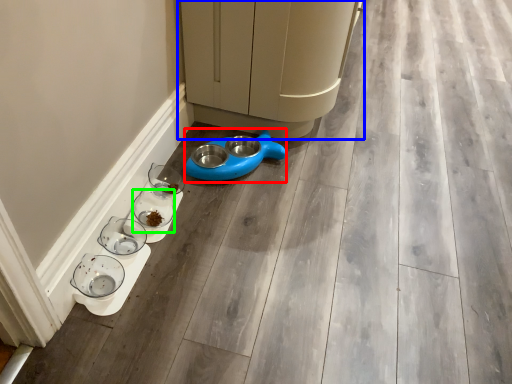
Question: Based on their relative distances, which object is nearer to appliance (highlighted by a red box)? Choose from furniture (highlighted by a blue box) and glass bowl (highlighted by a green box).

Choices:
 (A) furniture
 (B) glass bowl

Answer: (B)